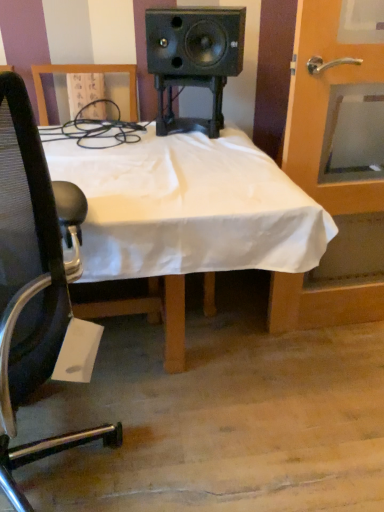
What do you see at coordinates (189, 214) in the screenshot?
I see `white cloth-covered desk at center` at bounding box center [189, 214].

This screenshot has width=384, height=512. What are the coordinates of `white cloth-covered desk at center` in the screenshot? It's located at (189, 214).

Based on the photo, considering the positions of objects wooden door at right and black mesh chair at left in the image provided, who is more to the left, wooden door at right or black mesh chair at left?

black mesh chair at left.

Is wooden door at right positioned in front of black mesh chair at left?

No, wooden door at right is further to the viewer.

From the image's perspective, who appears lower, wooden door at right or black mesh chair at left?

black mesh chair at left.

From a real-world perspective, between wooden door at right and black mesh chair at left, who is vertically higher?

wooden door at right.

Is black mesh chair at left bigger than wooden door at right?

Yes, black mesh chair at left is bigger than wooden door at right.

How different are the orientations of black mesh chair at left and wooden door at right in degrees?

168 degrees.

Consider the image. Which object is positioned more to the left, black mesh chair at left or wooden door at right?

From the viewer's perspective, black mesh chair at left appears more on the left side.

Considering the positions of points (51, 334) and (144, 252), is point (51, 334) farther from camera compared to point (144, 252)?

No.

Is black mesh chair at left bigger than white cloth-covered desk at center?

No, black mesh chair at left is not bigger than white cloth-covered desk at center.

From the picture: Which is more to the left, black mesh chair at left or white cloth-covered desk at center?

black mesh chair at left.

Is black mesh chair at left aimed at white cloth-covered desk at center?

Yes, black mesh chair at left is turned towards white cloth-covered desk at center.

Does white cloth-covered desk at center have a smaller size compared to black mesh chair at left?

No.

Does white cloth-covered desk at center touch black mesh chair at left?

No, white cloth-covered desk at center is not making contact with black mesh chair at left.

Is white cloth-covered desk at center positioned with its back to black mesh chair at left?

No, black mesh chair at left is not at the back of white cloth-covered desk at center.

Can you confirm if white cloth-covered desk at center is positioned to the left of black mesh chair at left?

No, white cloth-covered desk at center is not to the left of black mesh chair at left.

Is wooden door at right with white cloth-covered desk at center?

No, wooden door at right is not making contact with white cloth-covered desk at center.

Can you confirm if wooden door at right is wider than white cloth-covered desk at center?

Incorrect, the width of wooden door at right does not surpass that of white cloth-covered desk at center.

Is point (327, 295) closer or farther from the camera than point (155, 230)?

Clearly, point (327, 295) is more distant from the camera than point (155, 230).

Would you say wooden door at right is outside white cloth-covered desk at center?

That's correct, wooden door at right is outside of white cloth-covered desk at center.

Between white cloth-covered desk at center and wooden door at right, which one has less height?

Standing shorter between the two is white cloth-covered desk at center.

You are a GUI agent. You are given a task and a screenshot of the screen. Output one action in this format:
    pyautogui.click(x=<x>, y=<y>)
    Task: Click on the door to the right of white cloth-covered desk at center
    
    Given the screenshot: What is the action you would take?
    pyautogui.click(x=325, y=106)

Is white cloth-covered desk at center inside or outside of wooden door at right?

white cloth-covered desk at center exists outside the volume of wooden door at right.

Is wooden door at right at the back of white cloth-covered desk at center?

No, white cloth-covered desk at center is not facing away from wooden door at right.

Where is `chair on the left of wooden door at right`? Image resolution: width=384 pixels, height=512 pixels. chair on the left of wooden door at right is located at coordinates (37, 288).

Where is `door located above the black mesh chair at left (from a real-world perspective)`? Image resolution: width=384 pixels, height=512 pixels. door located above the black mesh chair at left (from a real-world perspective) is located at coordinates click(x=325, y=106).

Which object lies further to the anchor point wooden door at right, white cloth-covered desk at center or black mesh chair at left?

black mesh chair at left is positioned further to the anchor wooden door at right.

When comparing their distances from white cloth-covered desk at center, does wooden door at right or black mesh chair at left seem closer?

The object closer to white cloth-covered desk at center is black mesh chair at left.

Consider the image. From the image, which object appears to be nearer to white cloth-covered desk at center, black mesh chair at left or wooden door at right?

black mesh chair at left is closer to white cloth-covered desk at center.

Based on their spatial positions, is wooden door at right or white cloth-covered desk at center further from black mesh chair at left?

The object further to black mesh chair at left is wooden door at right.

Considering their positions, is black mesh chair at left positioned closer to wooden door at right than white cloth-covered desk at center?

white cloth-covered desk at center.

Looking at the image, which one is located closer to black mesh chair at left, white cloth-covered desk at center or wooden door at right?

white cloth-covered desk at center is closer to black mesh chair at left.

Locate an element on the screen. desk between black mesh chair at left and wooden door at right in the horizontal direction is located at coordinates (189, 214).